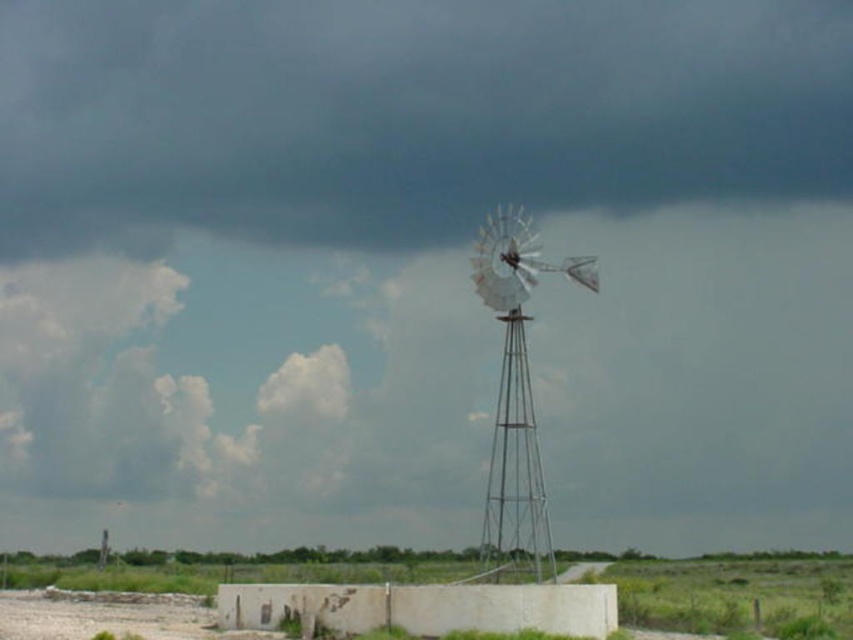
You are a photographer planning to capture the cloudy sky at upper center and the metallic silver windmill at center in a single frame. Considering their positions, will the windmill be mostly visible in the photo?

The cloudy sky at upper center is much taller than the metallic silver windmill at center, so the windmill will be mostly visible in the photo as it is positioned lower and not obscured by the sky.

Based on the scene description, which object occupies a more prominent position in the image, the cloudy sky at upper center or the metallic silver windmill at center? Please explain your reasoning using their sizes.

The cloudy sky at upper center has a larger size compared to the metallic silver windmill at center, making it more prominent in the image.

You are standing at the point closer to the windmill in the middle ground. Which point are you at, point [759,500] or point [521,257]?

You are at point [521,257] because it is closer to the windmill in the middle ground than point [759,500], which is behind it.